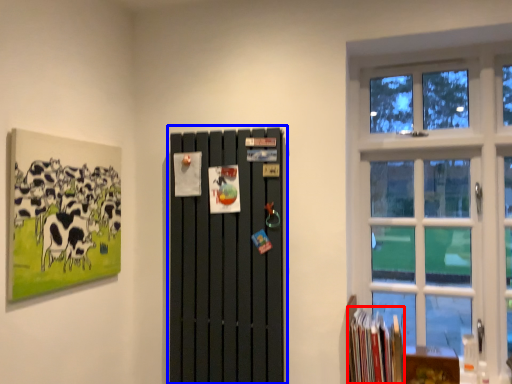
Question: Which object is closer to the camera taking this photo, book (highlighted by a red box) or barn door (highlighted by a blue box)?

Choices:
 (A) book
 (B) barn door

Answer: (B)